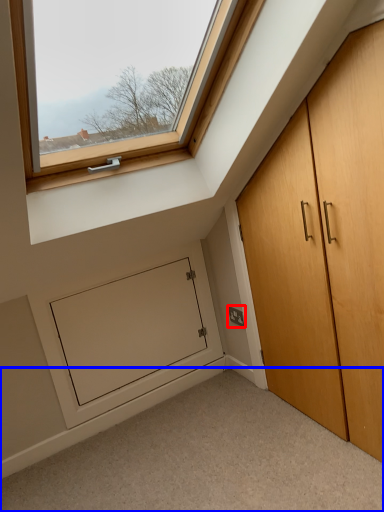
Question: Among these objects, which one is farthest to the camera, electric outlet (highlighted by a red box) or corridor (highlighted by a blue box)?

Choices:
 (A) electric outlet
 (B) corridor

Answer: (A)